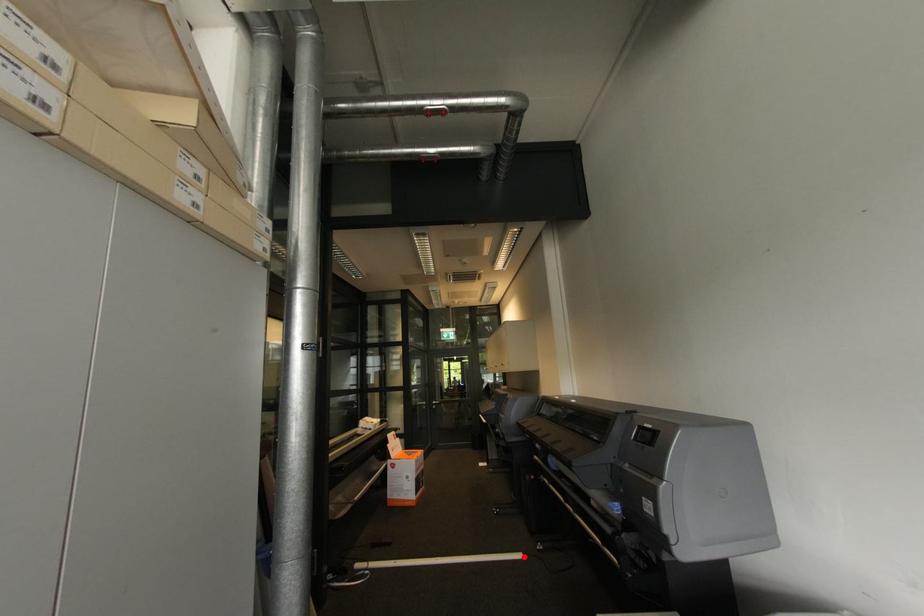
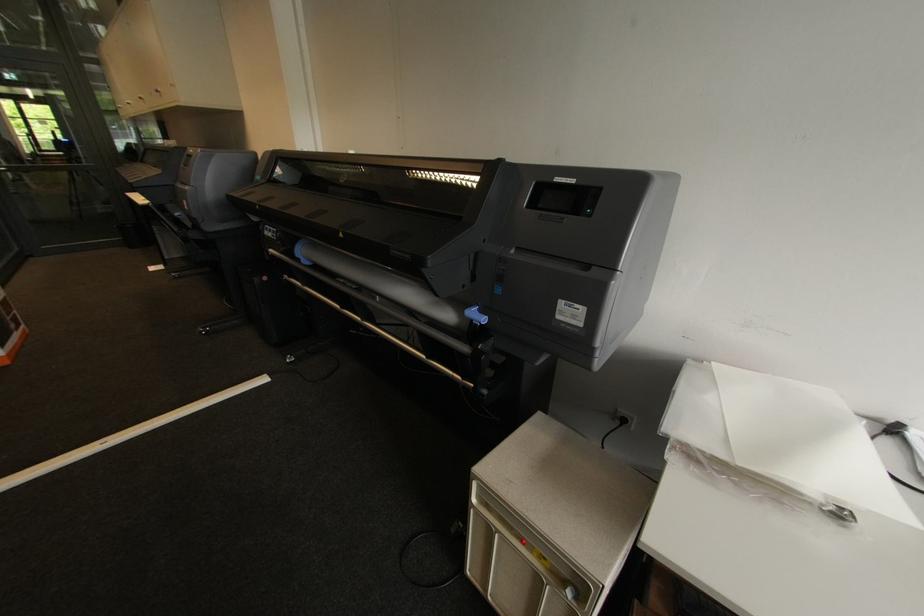
In the second image, find the point that corresponds to the highlighted location in the first image.

(268, 379)